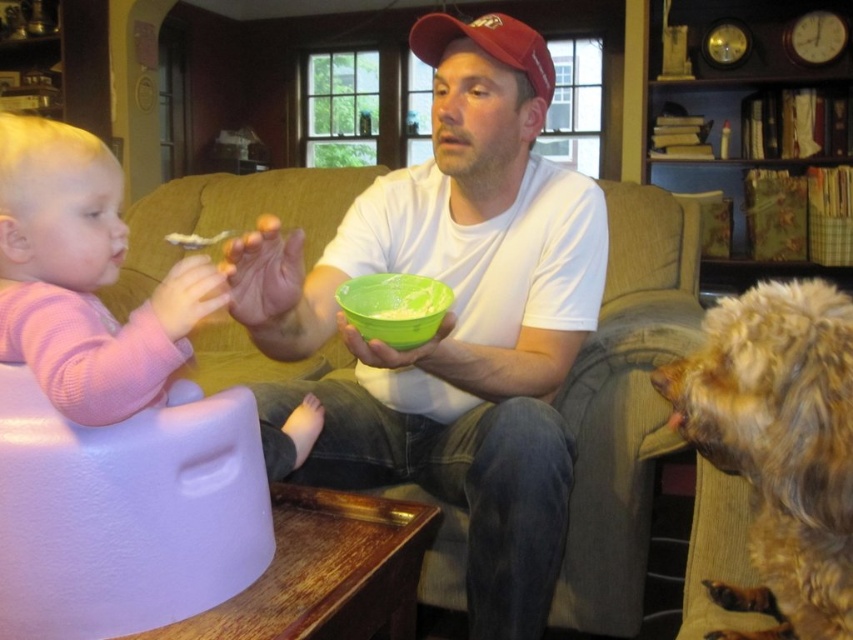
You are a parent in the living room and want to give your child a snack. The green plastic bowl at center contains yogurt. You have a white matte cracker at upper left. Can the cracker fit inside the bowl?

The green plastic bowl at center is taller than the white matte cracker at upper left, so the cracker can fit inside the bowl since the bowl has enough height to accommodate it.

You are a parent trying to place a new toy on the table between the pink soft fabric baby at left and the green matte bowl at center. According to the scene, which object is wider so that the toy can be placed closer to it?

The pink soft fabric baby at left is wider than the green matte bowl at center, so the toy should be placed closer to the pink soft fabric baby at left to ensure stability.

You are a parent in the living room and want to give your child a snack. You have a green plastic bowl at center and a white matte cracker at upper left. Which item is narrower so it can fit into a small container?

The green plastic bowl at center has a lesser width compared to the white matte cracker at upper left, so the green plastic bowl at center is narrower and can fit into the small container.